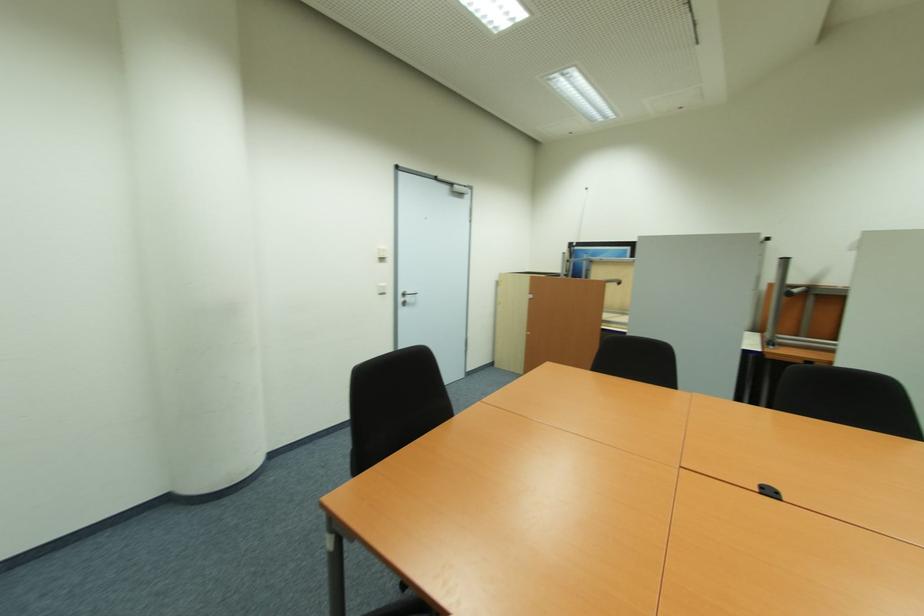
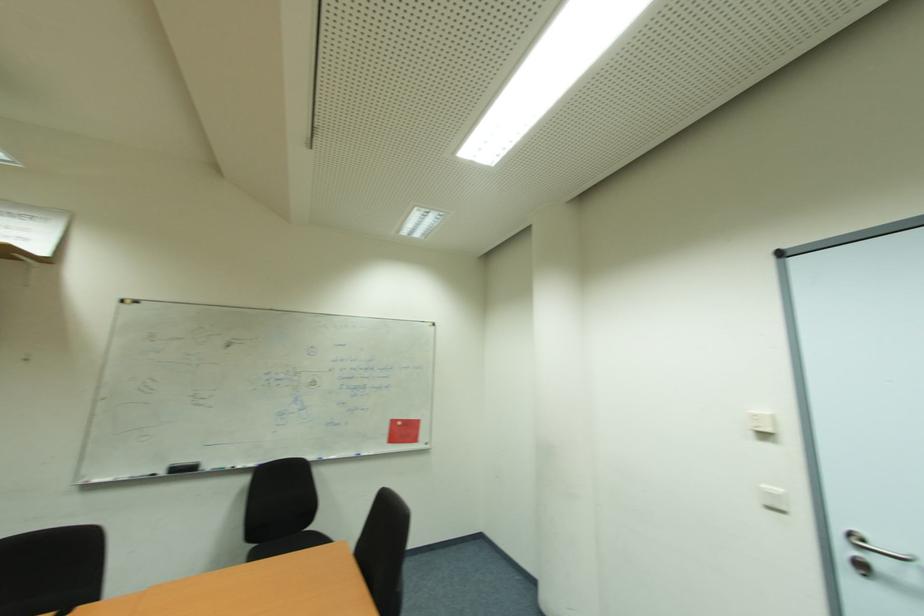
Find the pixel in the second image that matches point (407, 304) in the first image.

(869, 570)